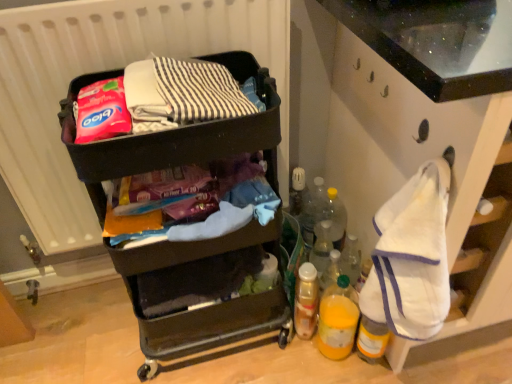
Question: Is translucent yellow bottle at lower right, the 1th bottle when ordered from bottom to top, far away from translucent plastic spray can at lower center, placed as the 2th bottle when sorted from bottom to top?

Choices:
 (A) yes
 (B) no

Answer: (B)

Question: From a real-world perspective, is translucent yellow bottle at lower right, the fourth bottle positioned from the top, physically above translucent plastic spray can at lower center, which is counted as the 3th bottle, starting from the top?

Choices:
 (A) yes
 (B) no

Answer: (A)

Question: Does translucent yellow bottle at lower right, the 1th bottle when ordered from bottom to top, have a larger size compared to translucent plastic spray can at lower center, which is counted as the 3th bottle, starting from the top?

Choices:
 (A) no
 (B) yes

Answer: (B)

Question: Is translucent yellow bottle at lower right, the 1th bottle when ordered from bottom to top, to the right of translucent plastic spray can at lower center, placed as the 2th bottle when sorted from bottom to top, from the viewer's perspective?

Choices:
 (A) yes
 (B) no

Answer: (A)

Question: Is the depth of translucent yellow bottle at lower right, the 1th bottle when ordered from bottom to top, greater than that of translucent plastic spray can at lower center, which is counted as the 3th bottle, starting from the top?

Choices:
 (A) no
 (B) yes

Answer: (A)

Question: Does translucent yellow bottle at lower right, the 1th bottle when ordered from bottom to top, touch translucent plastic spray can at lower center, which is counted as the 3th bottle, starting from the top?

Choices:
 (A) no
 (B) yes

Answer: (B)

Question: Is translucent yellow bottle at lower right, the fourth bottle positioned from the top, to the right of black plastic cart at upper left from the viewer's perspective?

Choices:
 (A) no
 (B) yes

Answer: (B)

Question: Are translucent yellow bottle at lower right, the 1th bottle when ordered from bottom to top, and black plastic cart at upper left beside each other?

Choices:
 (A) no
 (B) yes

Answer: (A)

Question: Does translucent yellow bottle at lower right, the fourth bottle positioned from the top, have a larger size compared to black plastic cart at upper left?

Choices:
 (A) no
 (B) yes

Answer: (A)

Question: From a real-world perspective, is translucent yellow bottle at lower right, the fourth bottle positioned from the top, beneath black plastic cart at upper left?

Choices:
 (A) yes
 (B) no

Answer: (A)

Question: From a real-world perspective, is translucent yellow bottle at lower right, the 1th bottle when ordered from bottom to top, on black plastic cart at upper left?

Choices:
 (A) yes
 (B) no

Answer: (B)

Question: Is translucent yellow bottle at lower right, the 1th bottle when ordered from bottom to top, smaller than black plastic cart at upper left?

Choices:
 (A) no
 (B) yes

Answer: (B)

Question: Does translucent plastic bottle at lower right, the 2th bottle in the top-to-bottom sequence, have a smaller size compared to white matte radiator at upper left?

Choices:
 (A) yes
 (B) no

Answer: (A)